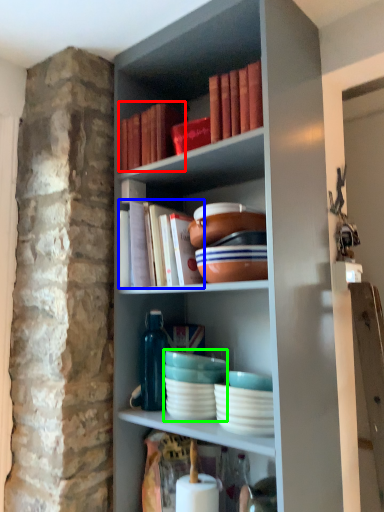
Question: Which is nearer to the book (highlighted by a red box)? book (highlighted by a blue box) or tableware (highlighted by a green box).

Choices:
 (A) book
 (B) tableware

Answer: (A)